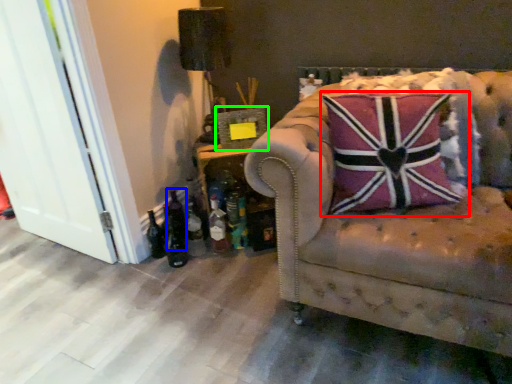
Question: Which object is positioned closest to pillow (highlighted by a red box)? Select from beer bottle (highlighted by a blue box) and picture frame (highlighted by a green box).

Choices:
 (A) beer bottle
 (B) picture frame

Answer: (B)